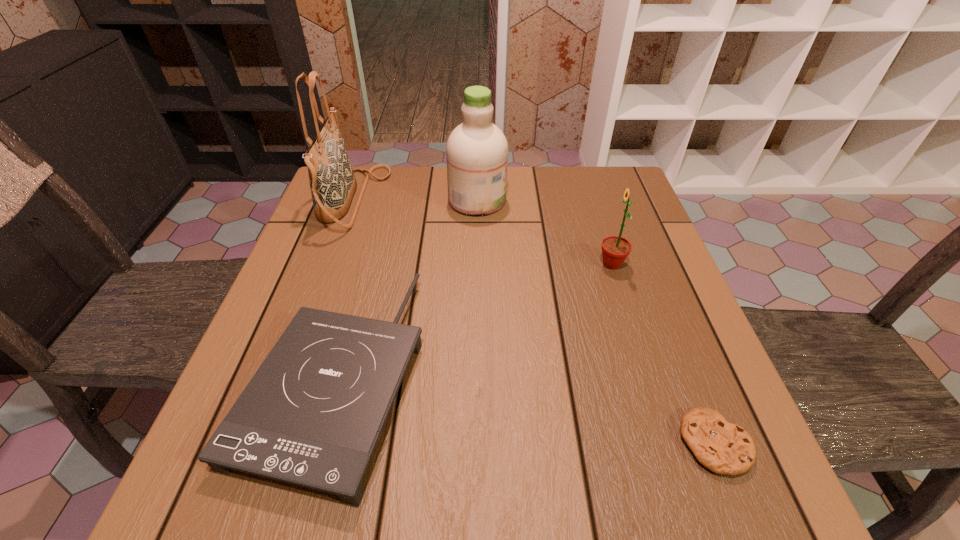
The image size is (960, 540). Find the location of `free point between the handbag and the cleansing agent`. free point between the handbag and the cleansing agent is located at coordinates (415, 200).

You are a GUI agent. You are given a task and a screenshot of the screen. Output one action in this format:
    pyautogui.click(x=<x>, y=<y>)
    Task: Click on the vacant space in between the hotplate and the handbag
    The width and height of the screenshot is (960, 540).
    Given the screenshot: What is the action you would take?
    pyautogui.click(x=345, y=287)

Locate an element on the screen. unoccupied position between the hotplate and the sunflower is located at coordinates (474, 320).

Where is `free space between the fourth tallest object and the sunflower`? free space between the fourth tallest object and the sunflower is located at coordinates (474, 320).

Where is `empty location between the cookie and the second shortest object`? This screenshot has width=960, height=540. empty location between the cookie and the second shortest object is located at coordinates (526, 409).

Find the location of `vacant region between the sunflower and the fourth tallest object`. vacant region between the sunflower and the fourth tallest object is located at coordinates (474, 320).

Locate an element on the screen. Image resolution: width=960 pixels, height=540 pixels. vacant space that's between the third shortest object and the handbag is located at coordinates (482, 232).

Where is `unoccupied position between the handbag and the cleansing agent`? unoccupied position between the handbag and the cleansing agent is located at coordinates (415, 200).

Where is `vacant space in between the handbag and the cookie`? The width and height of the screenshot is (960, 540). vacant space in between the handbag and the cookie is located at coordinates (534, 322).

Locate which object is the fourth closest to the handbag. Please provide its 2D coordinates. Your answer should be formatted as a tuple, i.e. [(x, y)], where the tuple contains the x and y coordinates of a point satisfying the conditions above.

[(724, 448)]